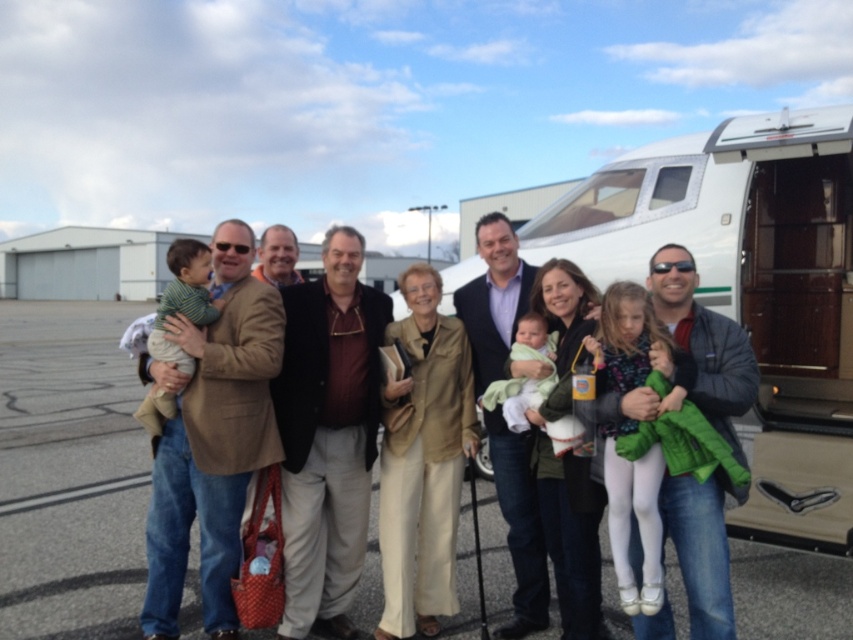
Who is more distant from viewer, (x=358, y=492) or (x=549, y=358)?

Point (x=358, y=492)

Is matte brown jacket at center to the right of white soft fabric baby at center from the viewer's perspective?

No, matte brown jacket at center is not to the right of white soft fabric baby at center.

What are the coordinates of `matte brown jacket at center` in the screenshot? It's located at (328, 412).

Between white glossy recreational vehicle at right and matte brown jacket at center, which one has more height?

matte brown jacket at center

Can you confirm if white glossy recreational vehicle at right is taller than matte brown jacket at center?

In fact, white glossy recreational vehicle at right may be shorter than matte brown jacket at center.

Who is more forward, (679, 161) or (376, 378)?

Positioned in front is point (376, 378).

I want to click on white glossy recreational vehicle at right, so click(747, 289).

Between point (770, 164) and point (537, 387), which one is positioned in front?

Positioned in front is point (537, 387).

Which of these two, white glossy recreational vehicle at right or white soft fabric baby at center, stands taller?

Standing taller between the two is white soft fabric baby at center.

The image size is (853, 640). I want to click on white glossy recreational vehicle at right, so click(747, 289).

This screenshot has width=853, height=640. Identify the location of white glossy recreational vehicle at right. (747, 289).